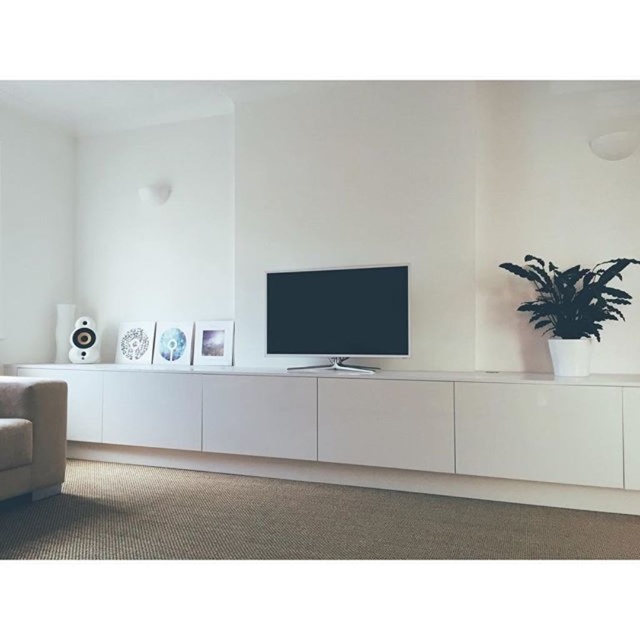
Question: Where is green leafy plant at right located in relation to white glossy speaker at left in the image?

Choices:
 (A) above
 (B) below

Answer: (A)

Question: Which of the following is the closest to the observer?

Choices:
 (A) (476, 444)
 (B) (77, 337)

Answer: (A)

Question: Does green leafy plant at right appear on the right side of white glossy speaker at left?

Choices:
 (A) yes
 (B) no

Answer: (A)

Question: Which of the following is the farthest from the observer?

Choices:
 (A) (371, 371)
 (B) (401, 376)
 (C) (566, 275)

Answer: (A)

Question: In this image, where is flat screen tv at center located relative to green leafy plant at right?

Choices:
 (A) above
 (B) below

Answer: (B)

Question: Which object appears closest to the camera in this image?

Choices:
 (A) flat screen tv at center
 (B) white glossy entertainment center at center
 (C) green leafy plant at right

Answer: (B)